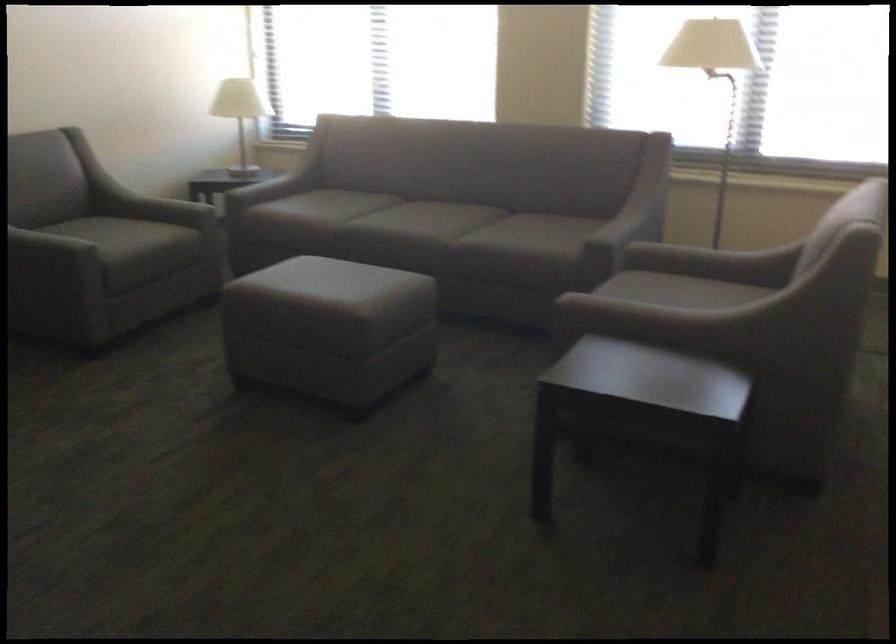
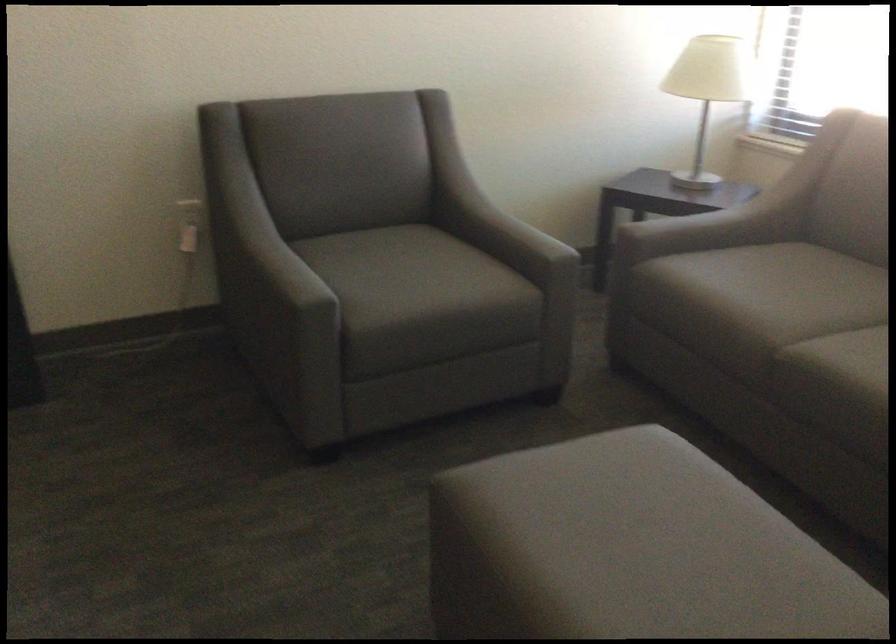
Where in the second image is the point corresponding to [326,278] from the first image?

(633, 542)